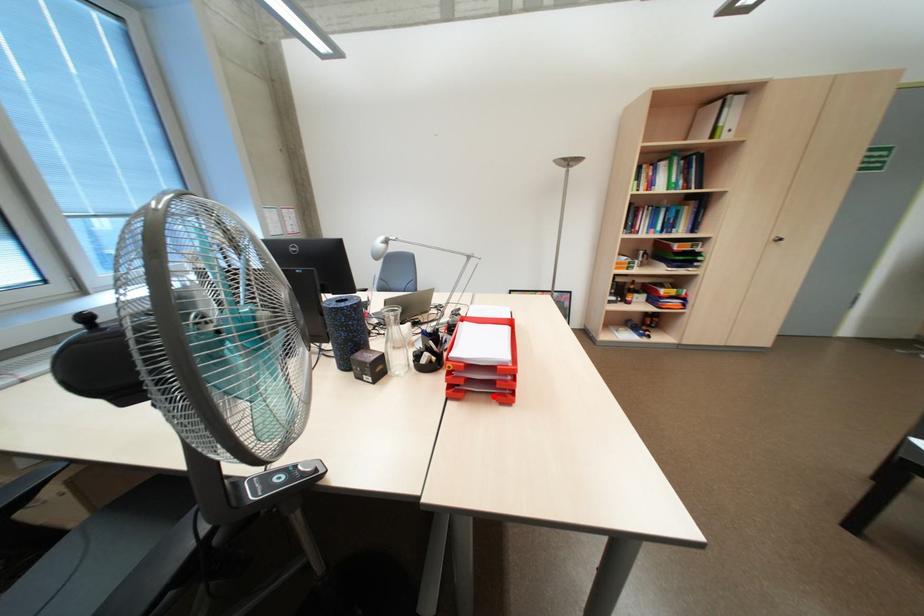
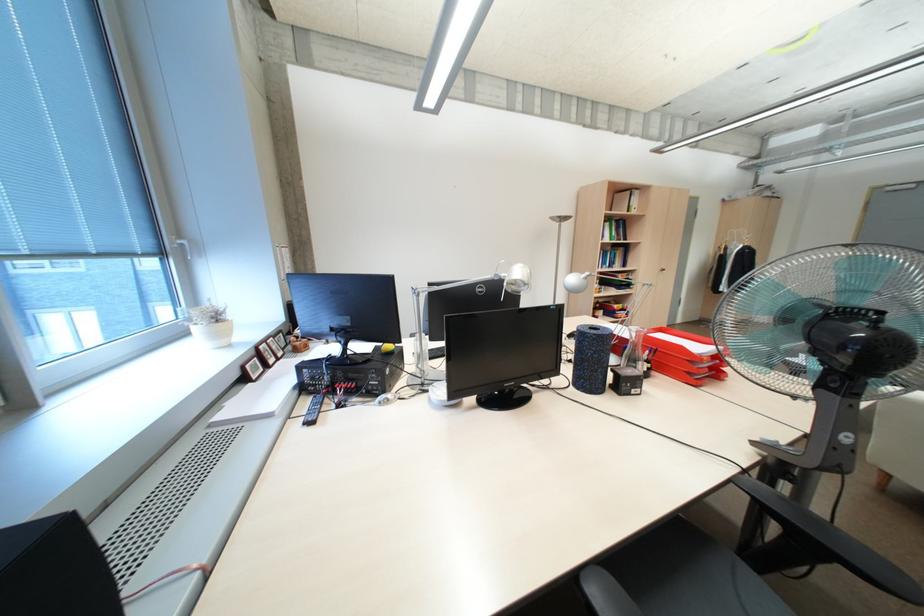
Question: I am providing you with two images of the same scene from different viewpoints. A red point is marked on the first image. At the location where the point appears in image 1, is it still visible in image 2?

Choices:
 (A) Yes
 (B) No

Answer: (A)